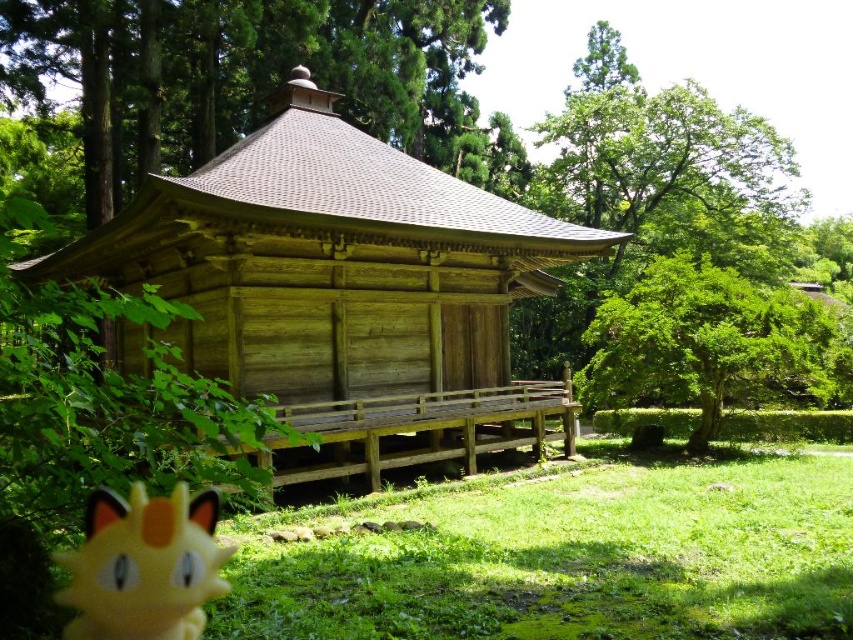
Does wooden hut at center have a greater height compared to green textured tree at upper left?

No.

In the scene shown: Measure the distance between point (381, 252) and camera.

The distance of point (381, 252) from camera is 46.35 feet.

Who is more forward, (207, 193) or (445, 40)?

Positioned in front is point (207, 193).

Identify the location of wooden hut at center. (344, 288).

Is green textured tree at upper left thinner than green leafy tree at center?

In fact, green textured tree at upper left might be wider than green leafy tree at center.

Which is below, green textured tree at upper left or green leafy tree at center?

green leafy tree at center

Describe the element at coordinates (241, 72) in the screenshot. The image size is (853, 640). I see `green textured tree at upper left` at that location.

In order to click on green textured tree at upper left in this screenshot , I will do `click(241, 72)`.

Between point (372, 140) and point (788, 561), which one is positioned behind?

The point (372, 140) is behind.

Is wooden hut at center to the left of green grass at lower center from the viewer's perspective?

Correct, you'll find wooden hut at center to the left of green grass at lower center.

Who is more forward, (448,392) or (842,625)?

Point (842,625) is more forward.

Where is `wooden hut at center`? wooden hut at center is located at coordinates (344, 288).